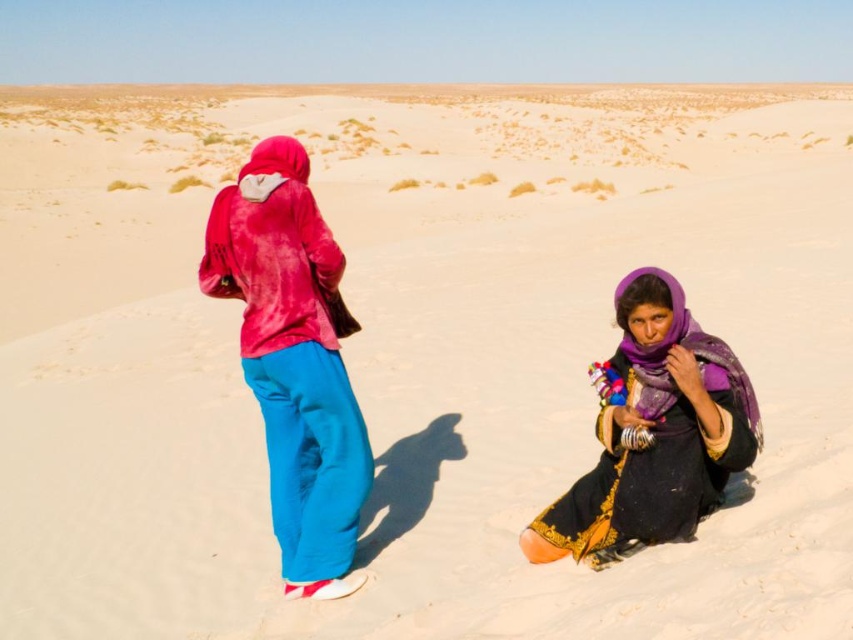
Does velvet red jacket at upper left have a smaller size compared to purple satin scarf at lower right?

No, velvet red jacket at upper left is not smaller than purple satin scarf at lower right.

Which of these two, velvet red jacket at upper left or purple satin scarf at lower right, stands shorter?

purple satin scarf at lower right

Locate an element on the screen. This screenshot has width=853, height=640. velvet red jacket at upper left is located at coordinates (293, 360).